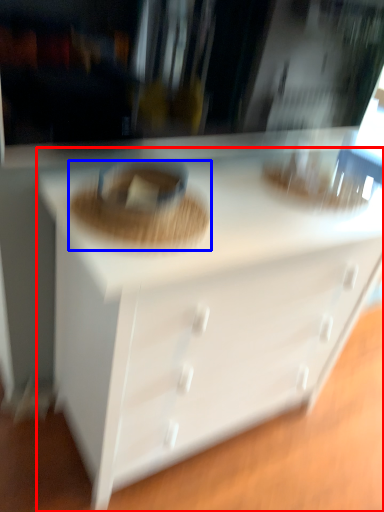
Question: Which object is further to the camera taking this photo, chest of drawers (highlighted by a red box) or food (highlighted by a blue box)?

Choices:
 (A) chest of drawers
 (B) food

Answer: (B)